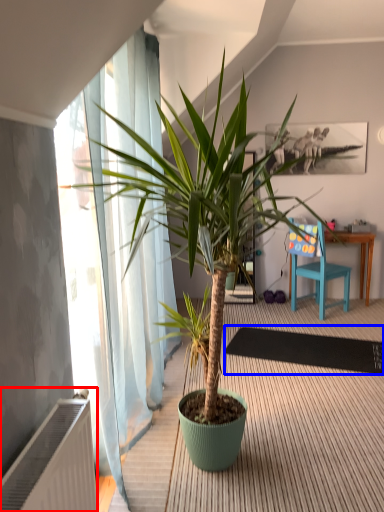
Question: Among these objects, which one is farthest to the camera, radiator (highlighted by a red box) or mat (highlighted by a blue box)?

Choices:
 (A) radiator
 (B) mat

Answer: (B)